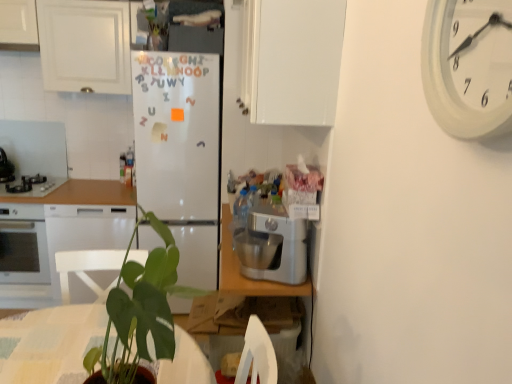
Question: Can you confirm if white glossy cabinet at upper left, the first cabinetry when ordered from back to front, is smaller than white matte cabinet at upper right, marked as the second cabinetry in a left-to-right arrangement?

Choices:
 (A) yes
 (B) no

Answer: (A)

Question: Is white glossy cabinet at upper left, acting as the 1th cabinetry starting from the left, taller than white matte cabinet at upper right, marked as the second cabinetry in a left-to-right arrangement?

Choices:
 (A) yes
 (B) no

Answer: (B)

Question: Does white glossy cabinet at upper left, the first cabinetry when ordered from back to front, have a larger size compared to white matte cabinet at upper right, marked as the second cabinetry in a left-to-right arrangement?

Choices:
 (A) no
 (B) yes

Answer: (A)

Question: Is white glossy cabinet at upper left, acting as the 1th cabinetry starting from the left, shorter than white matte cabinet at upper right, acting as the first cabinetry starting from the right?

Choices:
 (A) no
 (B) yes

Answer: (B)

Question: Is white glossy cabinet at upper left, acting as the 1th cabinetry starting from the left, touching white matte cabinet at upper right, the 2th cabinetry positioned from the back?

Choices:
 (A) yes
 (B) no

Answer: (B)

Question: From the image's perspective, is white glossy cabinet at upper left, which is the 2th cabinetry in front-to-back order, on white matte cabinet at upper right, acting as the first cabinetry starting from the right?

Choices:
 (A) yes
 (B) no

Answer: (A)

Question: Is white matte cabinet at upper right, marked as the second cabinetry in a left-to-right arrangement, completely or partially outside of silver metallic stand mixer at center?

Choices:
 (A) no
 (B) yes

Answer: (B)

Question: Is white matte cabinet at upper right, acting as the first cabinetry starting from the right, thinner than silver metallic stand mixer at center?

Choices:
 (A) yes
 (B) no

Answer: (B)

Question: From the image's perspective, is white matte cabinet at upper right, acting as the first cabinetry starting from the right, below silver metallic stand mixer at center?

Choices:
 (A) no
 (B) yes

Answer: (A)

Question: Considering the relative positions of white matte cabinet at upper right, which appears as the first cabinetry when viewed from the front, and silver metallic stand mixer at center in the image provided, is white matte cabinet at upper right, which appears as the first cabinetry when viewed from the front, to the right of silver metallic stand mixer at center from the viewer's perspective?

Choices:
 (A) yes
 (B) no

Answer: (A)

Question: Is white matte cabinet at upper right, which appears as the first cabinetry when viewed from the front, smaller than silver metallic stand mixer at center?

Choices:
 (A) yes
 (B) no

Answer: (B)

Question: Is white matte cabinet at upper right, marked as the second cabinetry in a left-to-right arrangement, aimed at silver metallic stand mixer at center?

Choices:
 (A) no
 (B) yes

Answer: (A)

Question: Is there a large distance between white matte refrigerator at center and white glossy cabinet at upper left, which is the 2th cabinetry in front-to-back order?

Choices:
 (A) no
 (B) yes

Answer: (A)